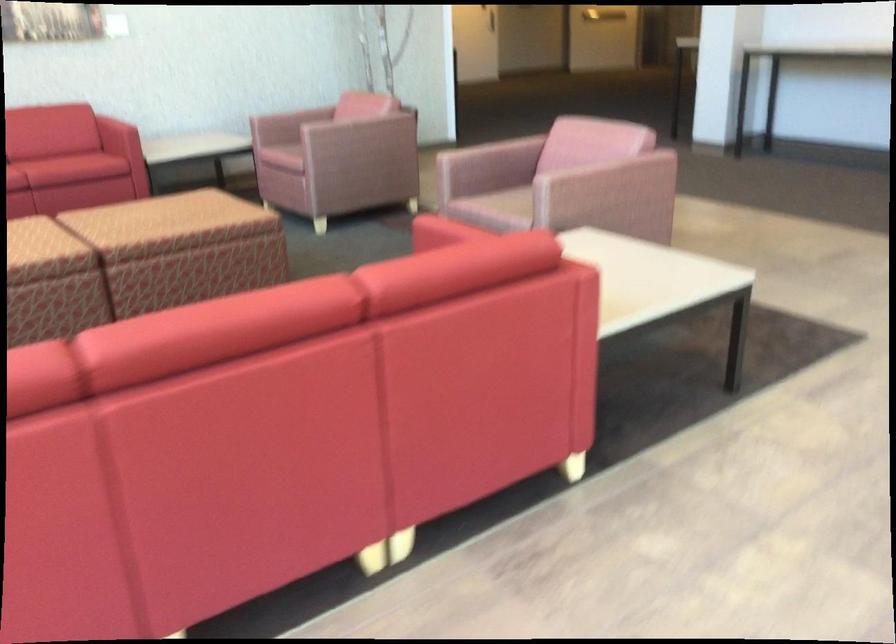
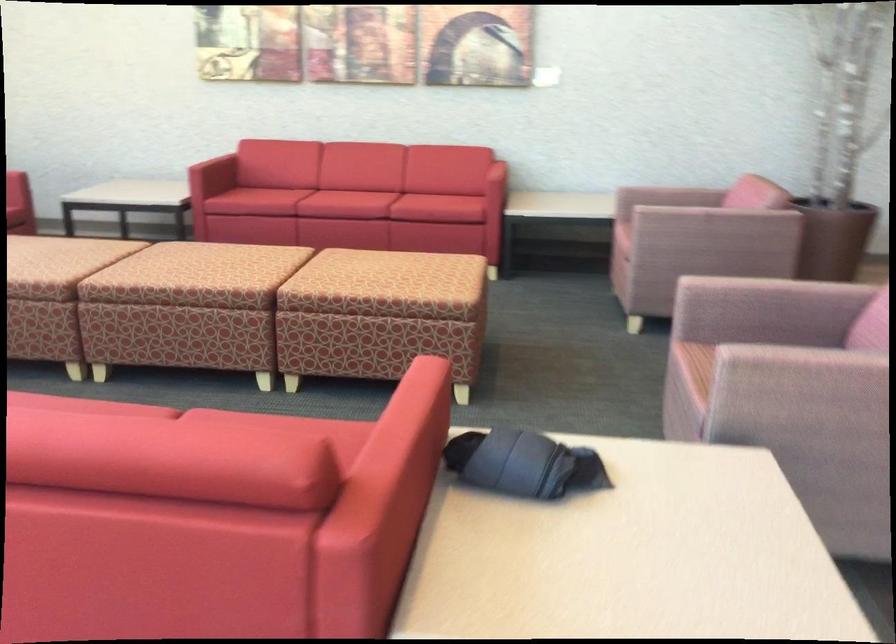
Locate, in the second image, the point that corresponds to (495,174) in the first image.

(760, 330)